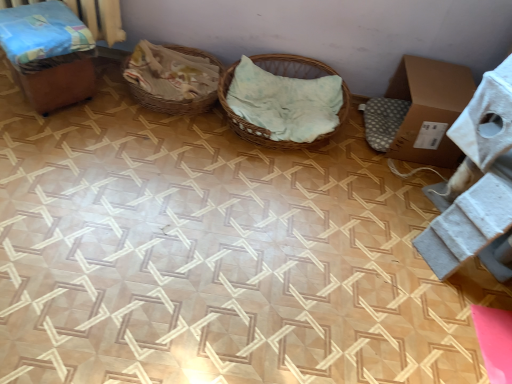
Where is `empty space that is in between wooden box at left and woven brown basket at center, positioned as the second basket in right-to-left order`? This screenshot has height=384, width=512. empty space that is in between wooden box at left and woven brown basket at center, positioned as the second basket in right-to-left order is located at coordinates (117, 111).